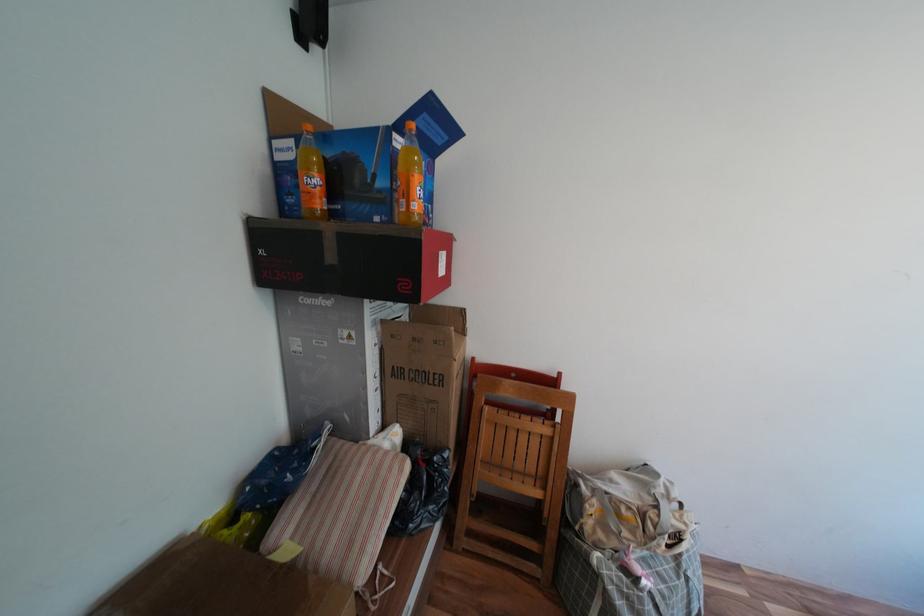
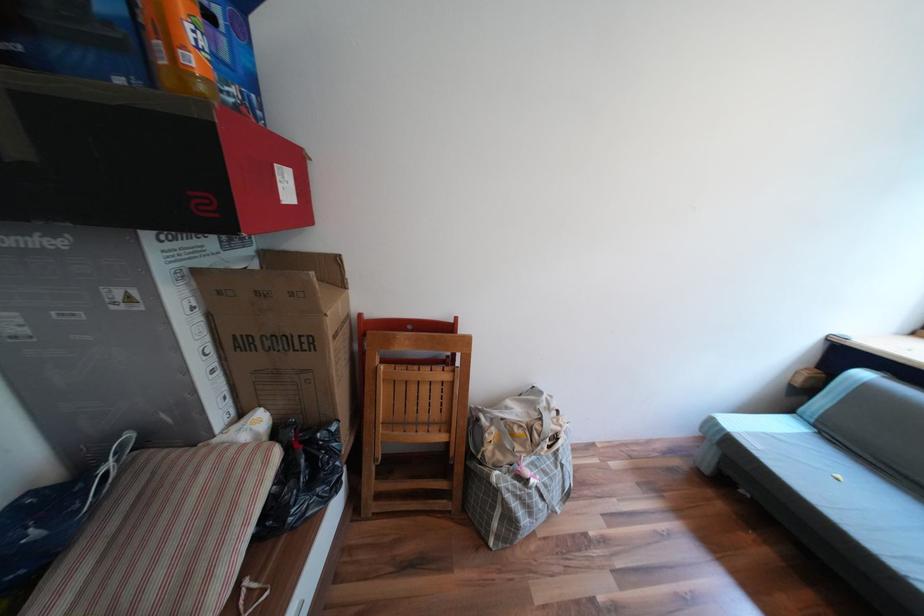
The point at (x=386, y=374) is marked in the first image. Where is the corresponding point in the second image?

(219, 349)